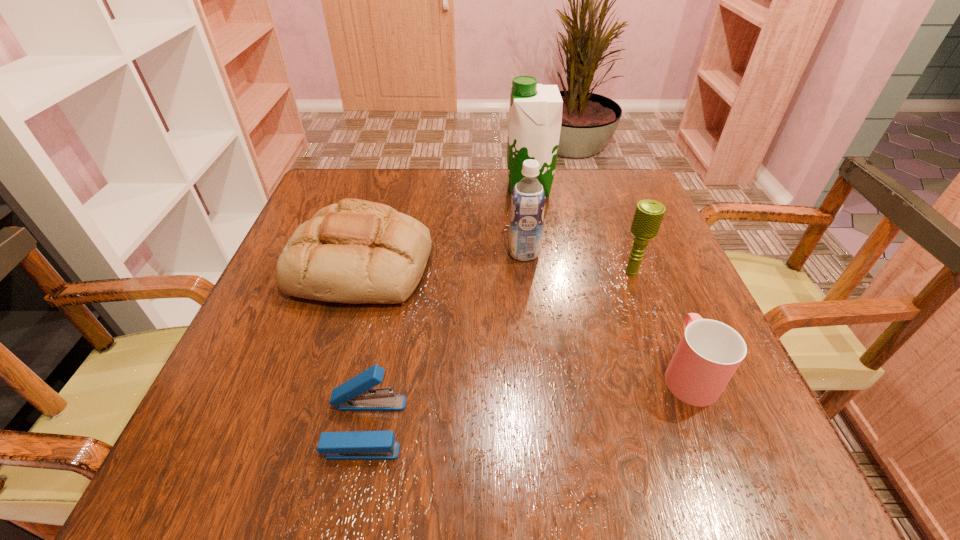
Where is `object that is at the far edge`? object that is at the far edge is located at coordinates (535, 114).

Find the location of a particular element. object that is at the near edge is located at coordinates (357, 394).

The height and width of the screenshot is (540, 960). Find the location of `object that is at the left edge`. object that is at the left edge is located at coordinates (357, 251).

This screenshot has width=960, height=540. I want to click on microphone located at the right edge, so click(x=648, y=216).

In order to click on cup positioned at the right edge in this screenshot , I will do `click(709, 352)`.

Image resolution: width=960 pixels, height=540 pixels. In the image, there is a desktop. What are the coordinates of `vacant space at the far edge` in the screenshot? It's located at (472, 169).

In the image, there is a desktop. At what (x,y) coordinates should I click in order to perform the action: click on vacant space at the left edge. Please return your answer as a coordinate pair (x, y). The image size is (960, 540). Looking at the image, I should click on (295, 342).

In the image, there is a desktop. Identify the location of vacant space at the right edge. (626, 262).

Locate an element on the screen. This screenshot has height=540, width=960. free spot at the far left corner of the desktop is located at coordinates (385, 171).

At what (x,y) coordinates should I click in order to perform the action: click on free space at the far right corner of the desktop. Please return your answer as a coordinate pair (x, y). Looking at the image, I should click on (605, 187).